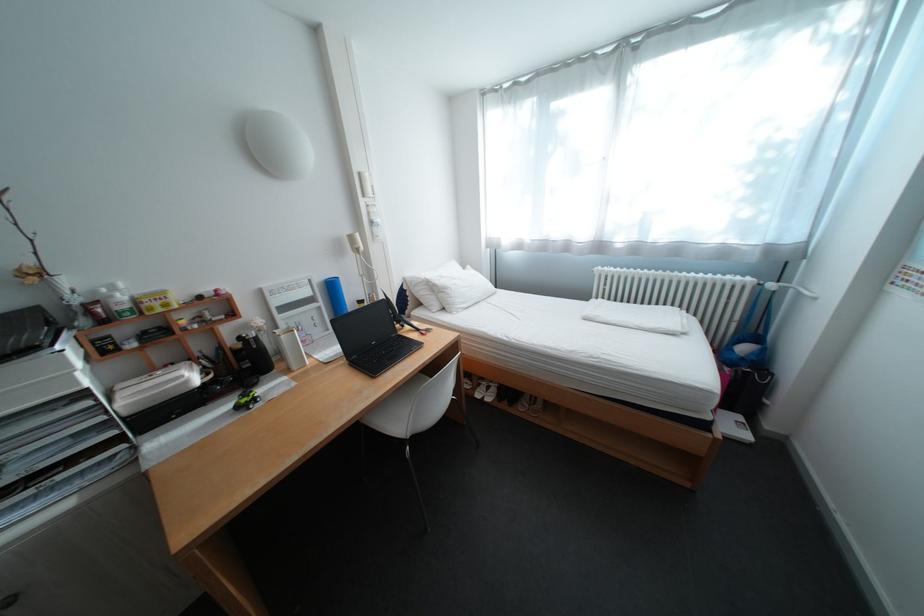
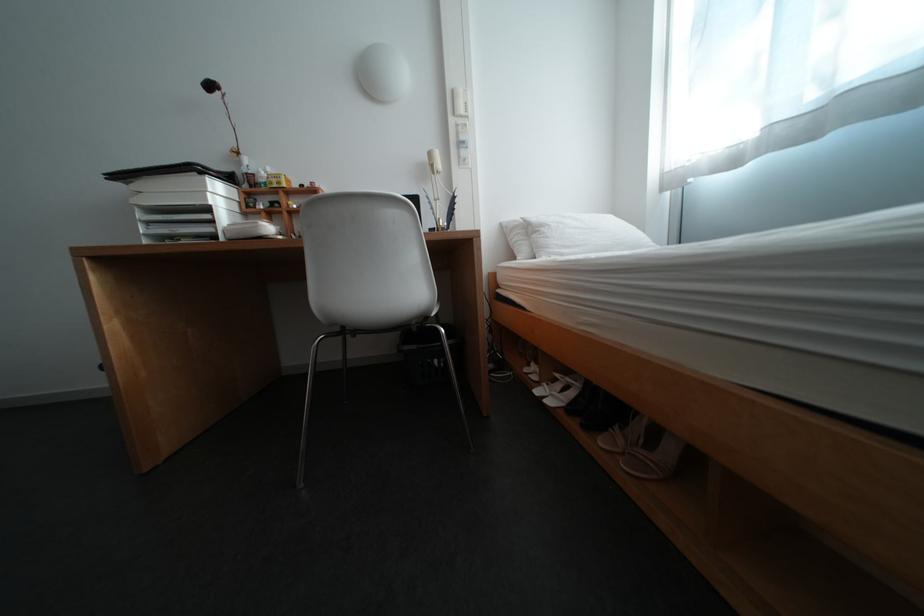
In the second image, find the point that corresponds to (506,399) in the first image.

(576, 406)